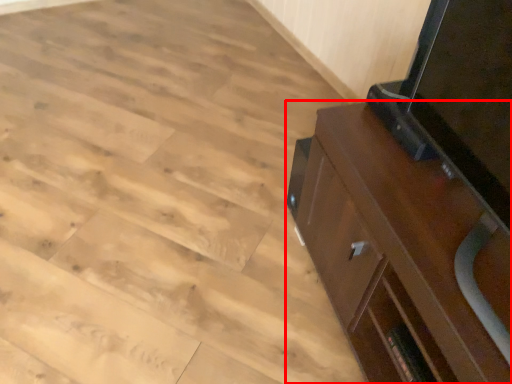
Question: Where is cabinetry (annotated by the red box) located in relation to plywood in the image?

Choices:
 (A) right
 (B) left

Answer: (A)